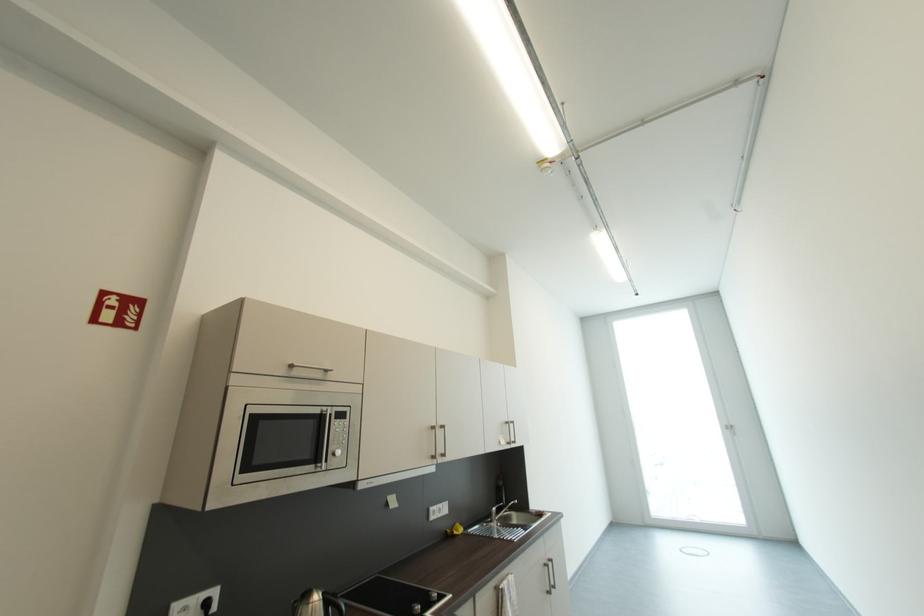
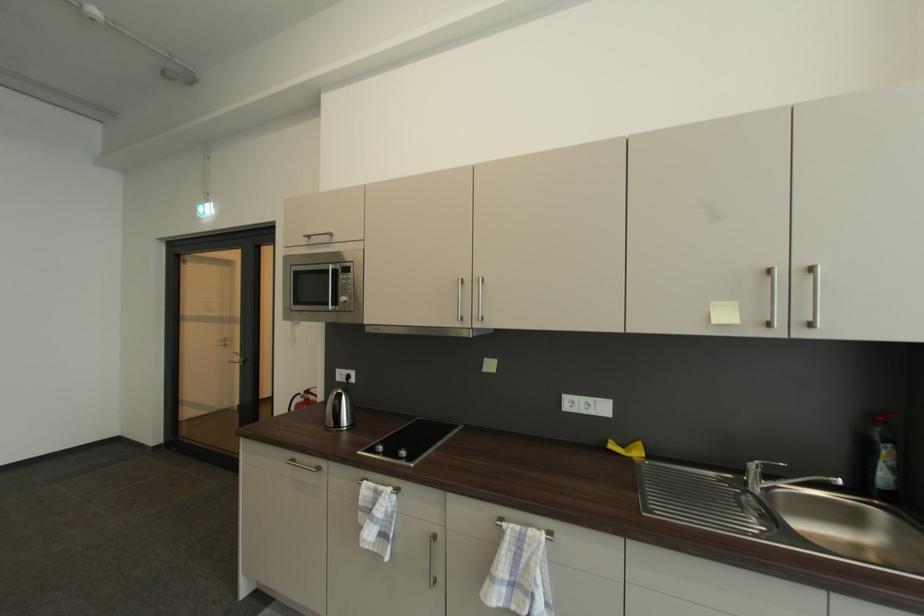
In the second image, find the point that corresponds to (454,533) in the first image.

(613, 443)